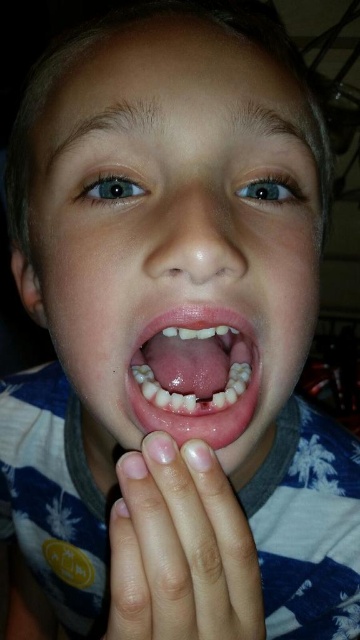
Question: Considering the relative positions of smooth skin face at center and pink flesh-colored teeth at center in the image provided, where is smooth skin face at center located with respect to pink flesh-colored teeth at center?

Choices:
 (A) above
 (B) below

Answer: (A)

Question: Does smooth skin face at center have a larger size compared to pink flesh-colored teeth at center?

Choices:
 (A) yes
 (B) no

Answer: (A)

Question: Which point is farther to the camera?

Choices:
 (A) (190, 433)
 (B) (87, 60)

Answer: (B)

Question: Which point is closer to the camera?

Choices:
 (A) smooth skin hand at lower center
 (B) smooth skin face at center
 (C) pink flesh-colored teeth at center

Answer: (B)

Question: Can you confirm if smooth skin hand at lower center is positioned below pink flesh-colored teeth at center?

Choices:
 (A) yes
 (B) no

Answer: (A)

Question: Among these objects, which one is nearest to the camera?

Choices:
 (A) smooth skin face at center
 (B) pink flesh-colored teeth at center
 (C) smooth skin hand at lower center

Answer: (A)